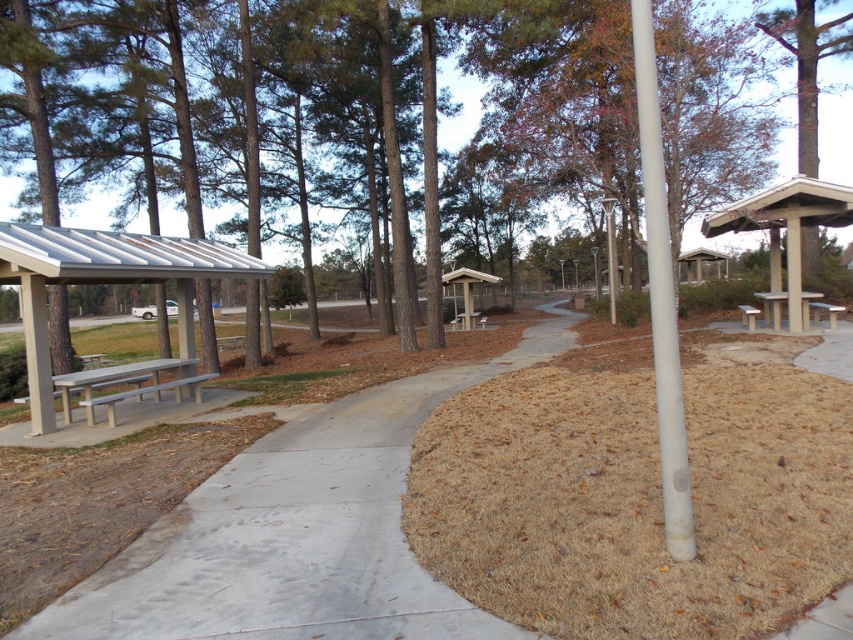
You are standing at the beginning of the curved pathway in the park and see two points marked in the scene. Which point, point (822,186) or point (805,310), is closer to you?

Point (822,186) is closer to the viewer than point (805,310), so the answer is point (822,186).

You are a pedestrian trying to reach a bench to rest. You see the wooden bus stop at center and the wooden park bench at center. Which object is closer to you?

The wooden park bench at center is closer because the wooden bus stop at center is positioned over it, meaning the bench is beneath the bus stop.